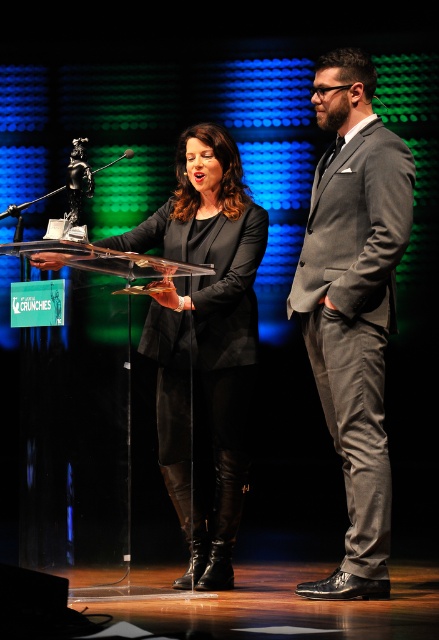
Does point (327, 280) come closer to viewer compared to point (183, 504)?

Yes, it is.

Can you confirm if gray suit at right is shorter than matte black dress at center?

No.

Is point (367, 436) farther from camera compared to point (230, 525)?

No, it is in front of (230, 525).

Find the location of a particular element. Image resolution: width=439 pixels, height=640 pixels. gray suit at right is located at coordinates (353, 304).